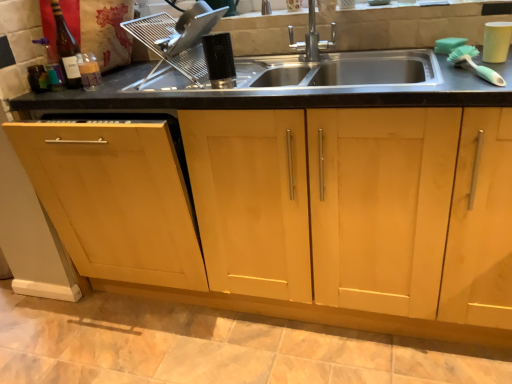
Question: From a real-world perspective, is translucent glass bottle at upper left located higher than light wood cabinet at center?

Choices:
 (A) no
 (B) yes

Answer: (B)

Question: Does translucent glass bottle at upper left lie behind light wood cabinet at center?

Choices:
 (A) yes
 (B) no

Answer: (A)

Question: Is translucent glass bottle at upper left bigger than light wood cabinet at center?

Choices:
 (A) no
 (B) yes

Answer: (A)

Question: Is light wood cabinet at center inside translucent glass bottle at upper left?

Choices:
 (A) no
 (B) yes

Answer: (A)

Question: Can you confirm if translucent glass bottle at upper left is shorter than light wood cabinet at center?

Choices:
 (A) yes
 (B) no

Answer: (A)

Question: Is translucent glass bottle at upper left positioned before light wood cabinet at center?

Choices:
 (A) no
 (B) yes

Answer: (A)

Question: Is satin silver dish rack at upper center, which is the 3th appliance from right to left, oriented away from white matte cup at upper right, the 3th appliance positioned from the left?

Choices:
 (A) no
 (B) yes

Answer: (A)

Question: From a real-world perspective, does satin silver dish rack at upper center, acting as the first appliance starting from the left, sit lower than white matte cup at upper right, the 3th appliance positioned from the left?

Choices:
 (A) no
 (B) yes

Answer: (A)

Question: From a real-world perspective, is satin silver dish rack at upper center, acting as the first appliance starting from the left, on white matte cup at upper right, the first appliance positioned from the right?

Choices:
 (A) yes
 (B) no

Answer: (A)

Question: Does satin silver dish rack at upper center, acting as the first appliance starting from the left, lie in front of white matte cup at upper right, the 3th appliance positioned from the left?

Choices:
 (A) no
 (B) yes

Answer: (A)

Question: Is satin silver dish rack at upper center, which is the 3th appliance from right to left, far away from white matte cup at upper right, the 3th appliance positioned from the left?

Choices:
 (A) no
 (B) yes

Answer: (A)

Question: From the image's perspective, does satin silver dish rack at upper center, acting as the first appliance starting from the left, appear higher than white matte cup at upper right, the 3th appliance positioned from the left?

Choices:
 (A) no
 (B) yes

Answer: (B)

Question: Is translucent glass bottle at upper left surrounding satin silver dish rack at upper center, acting as the first appliance starting from the left?

Choices:
 (A) yes
 (B) no

Answer: (B)